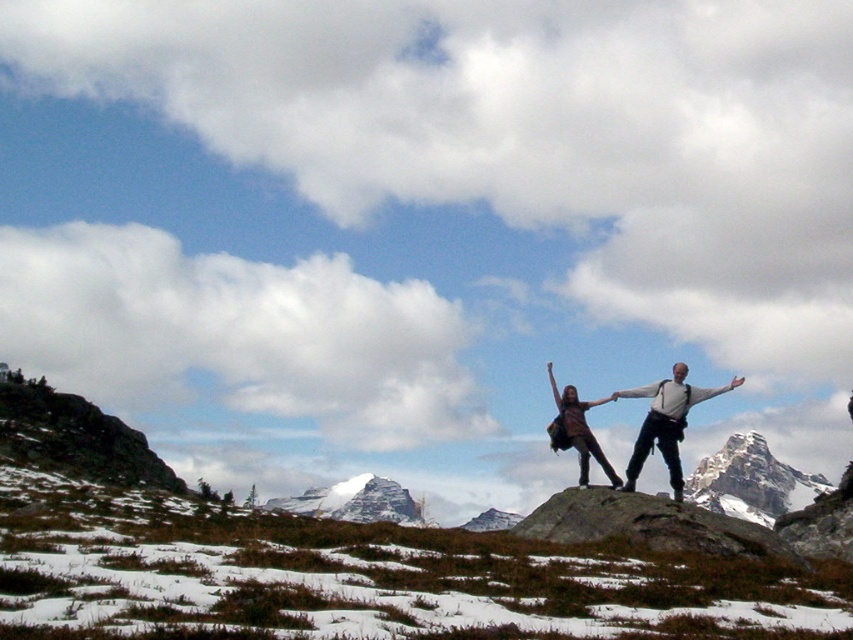
Question: Can you confirm if snowy granite peak at upper right is thinner than striped fabric dress at center?

Choices:
 (A) no
 (B) yes

Answer: (A)

Question: Which of the following is the farthest from the observer?

Choices:
 (A) striped fabric dress at center
 (B) matte brown backpack at center
 (C) snowy granite peak at upper right

Answer: (C)

Question: Considering the relative positions of snowy granite peak at upper right and matte brown backpack at center in the image provided, where is snowy granite peak at upper right located with respect to matte brown backpack at center?

Choices:
 (A) right
 (B) left

Answer: (A)

Question: Which point is farther from the camera taking this photo?

Choices:
 (A) (558, 401)
 (B) (675, 497)

Answer: (A)

Question: Does matte brown backpack at center have a greater width compared to striped fabric dress at center?

Choices:
 (A) yes
 (B) no

Answer: (A)

Question: Which point appears closest to the camera in this image?

Choices:
 (A) (660, 440)
 (B) (579, 410)
 (C) (770, 467)

Answer: (A)